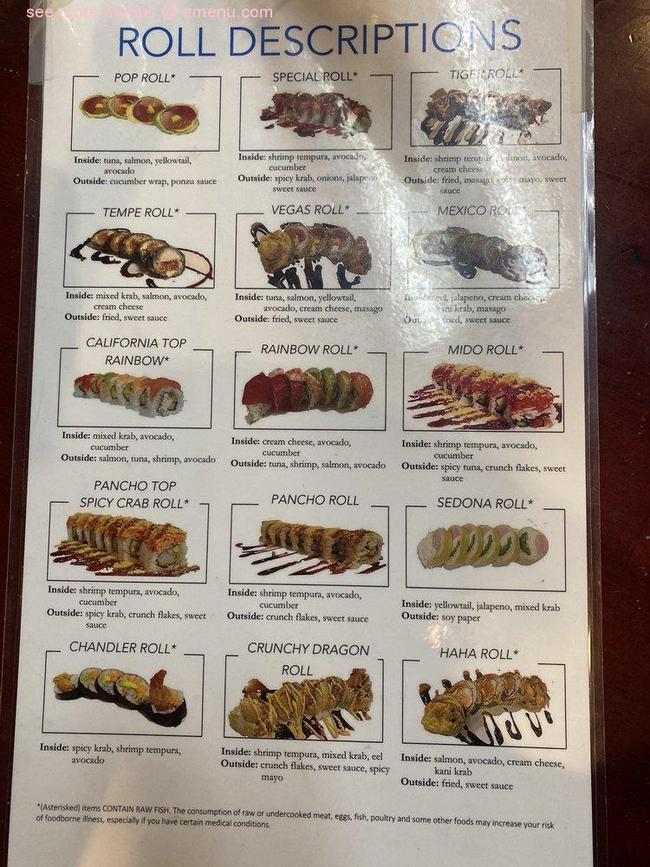
At what (x,y) coordinates should I click in order to perform the action: click on brown table. Please return your answer as a coordinate pair (x, y). This screenshot has width=650, height=867. Looking at the image, I should click on (629, 252).